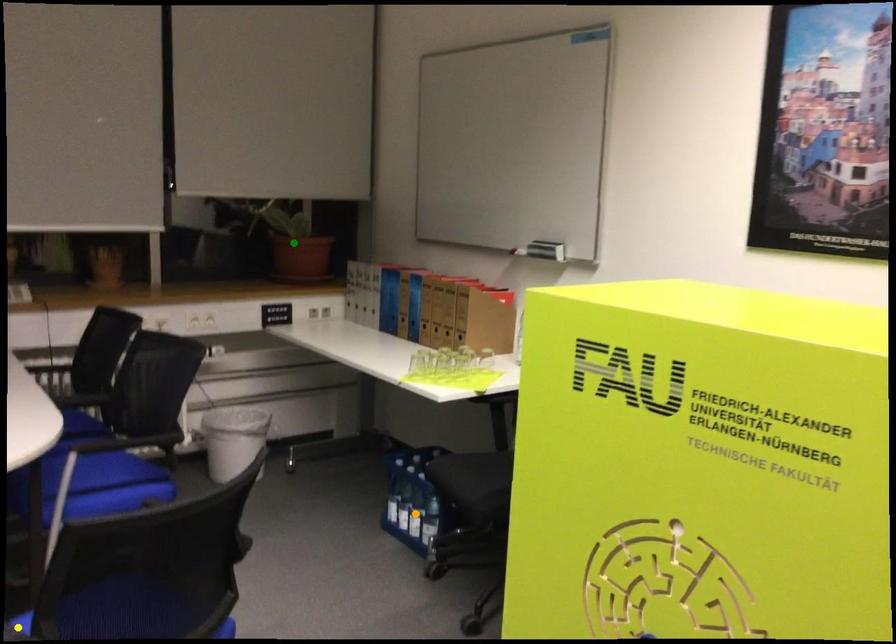
Order these from nearest to farthest:
orange point, yellow point, green point

yellow point < orange point < green point